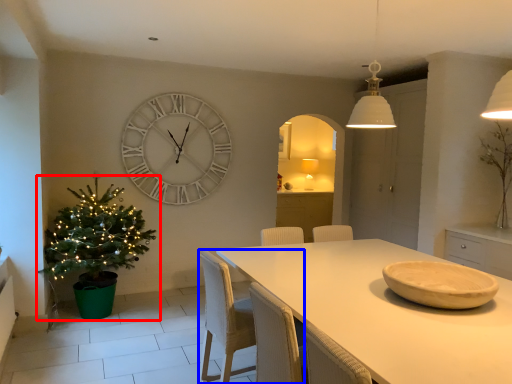
Question: Among these objects, which one is farthest to the camera, houseplant (highlighted by a red box) or chair (highlighted by a blue box)?

Choices:
 (A) houseplant
 (B) chair

Answer: (A)